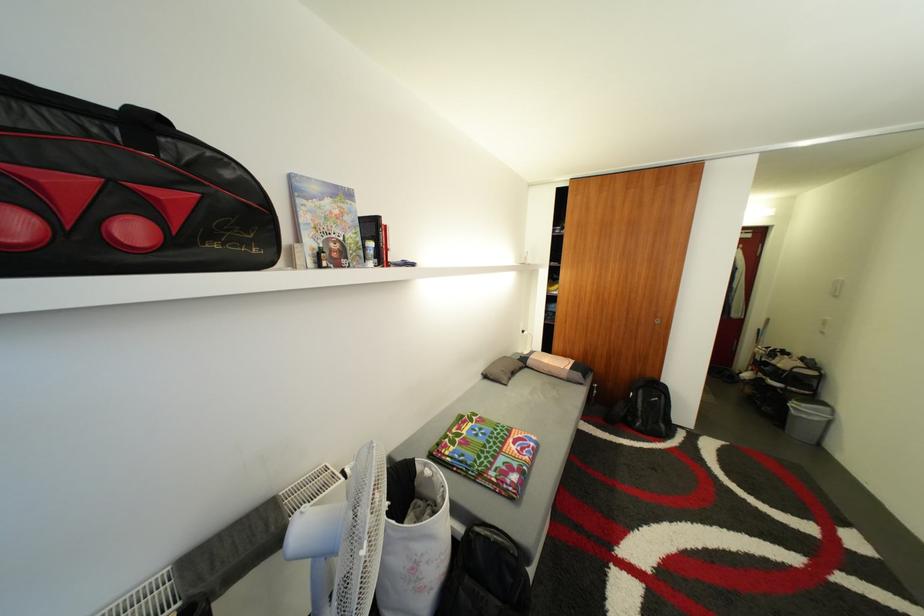
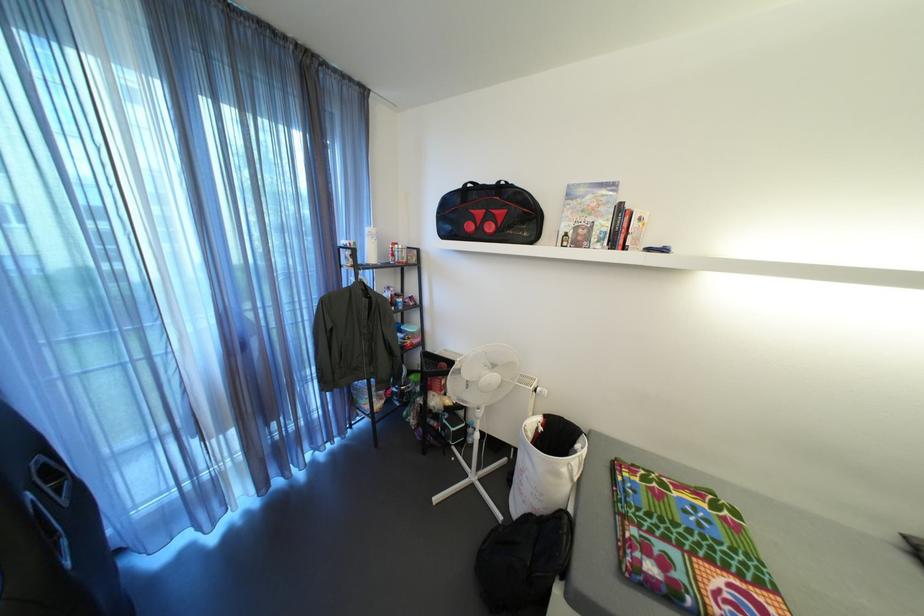
Question: The first image is from the beginning of the video and the second image is from the end. How did the camera likely rotate when shooting the video?

Choices:
 (A) Left
 (B) Right
 (C) Up
 (D) Down

Answer: (A)